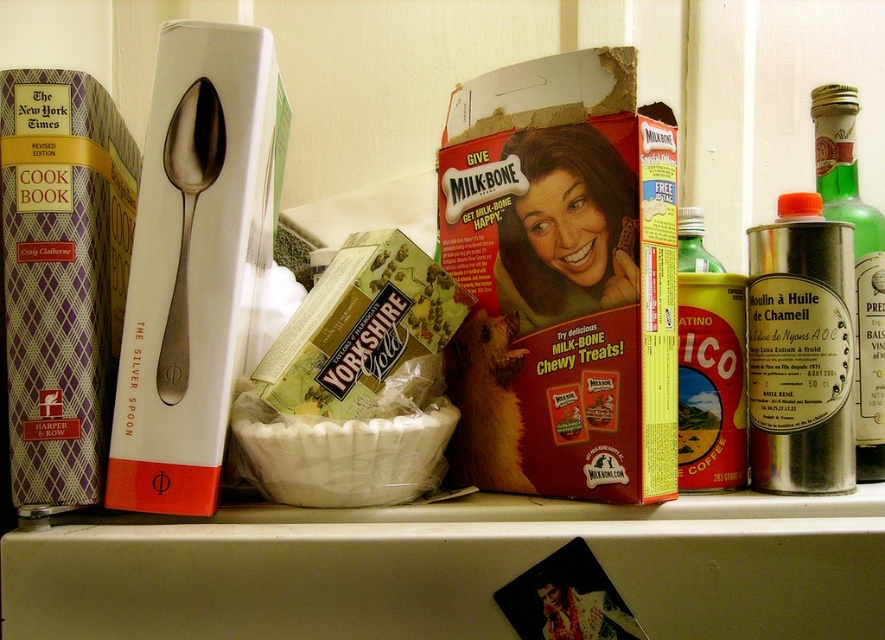
Question: Can you confirm if silver metallic canister at right is positioned to the right of metallic silver canister at center right?

Choices:
 (A) no
 (B) yes

Answer: (B)

Question: Which of these objects is positioned closest to the metallic silver canister at center right?

Choices:
 (A) silver metallic canister at right
 (B) metallic silver canister at right

Answer: (A)

Question: Where is metallic silver canister at right located in relation to metallic silver canister at center right in the image?

Choices:
 (A) left
 (B) right

Answer: (B)

Question: Estimate the real-world distances between objects in this image. Which object is farther from the metallic silver canister at center right?

Choices:
 (A) metallic silver canister at right
 (B) silver metallic canister at right

Answer: (A)

Question: Which point is closer to the camera taking this photo?

Choices:
 (A) (698, 253)
 (B) (878, 278)

Answer: (B)

Question: Can you confirm if silver metallic canister at right is smaller than metallic silver canister at center right?

Choices:
 (A) no
 (B) yes

Answer: (B)